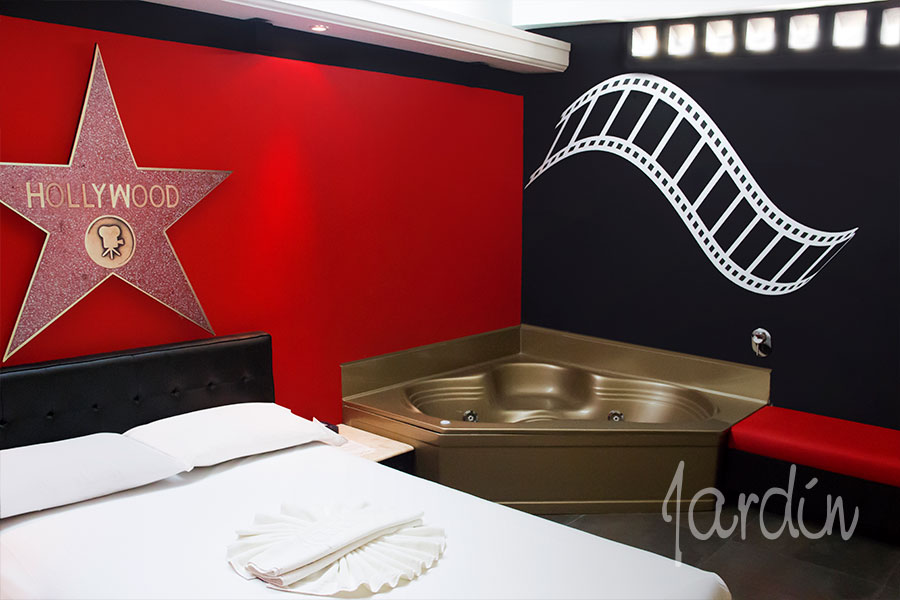
At what (x,y) coordinates should I click in order to perform the action: click on red wall. Please return your answer as a coordinate pair (x, y). The width and height of the screenshot is (900, 600). Looking at the image, I should click on (264, 248).